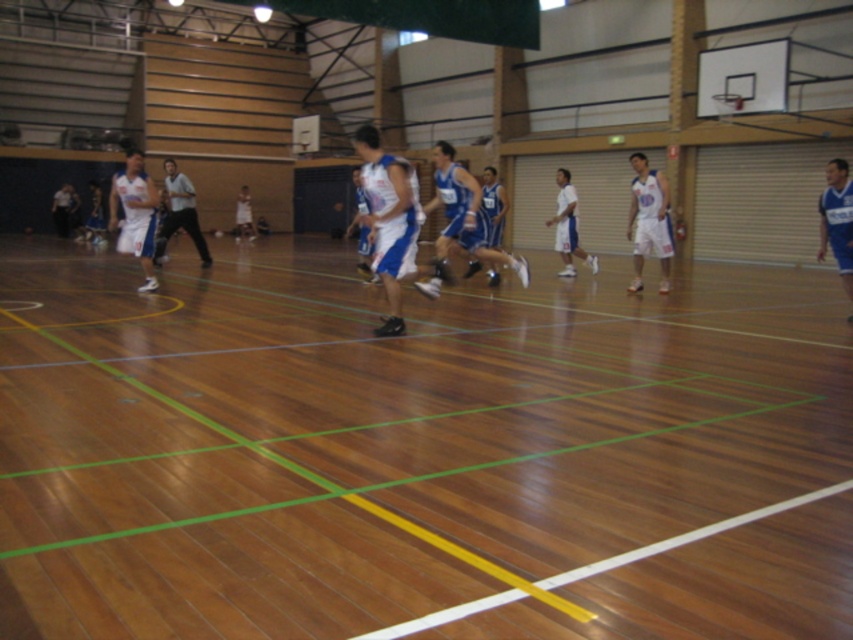
Locate an element on the screen. white/blue jersey at center is located at coordinates (389, 220).

This screenshot has width=853, height=640. What are the coordinates of `white/blue jersey at center` in the screenshot? It's located at (389, 220).

Where is `blue jersey shorts at center`? blue jersey shorts at center is located at coordinates (461, 221).

Is point (445, 212) positioned in front of point (846, 234)?

That is False.

The height and width of the screenshot is (640, 853). In order to click on blue jersey shorts at center in this screenshot , I will do `click(461, 221)`.

Is point (125, 184) positioned after point (175, 163)?

No, it is in front of (175, 163).

Is white jersey at left in front of matte black shorts at center?

Yes, it is in front of matte black shorts at center.

What do you see at coordinates (135, 212) in the screenshot? The image size is (853, 640). I see `white jersey at left` at bounding box center [135, 212].

The image size is (853, 640). Find the location of `white jersey at left`. white jersey at left is located at coordinates (135, 212).